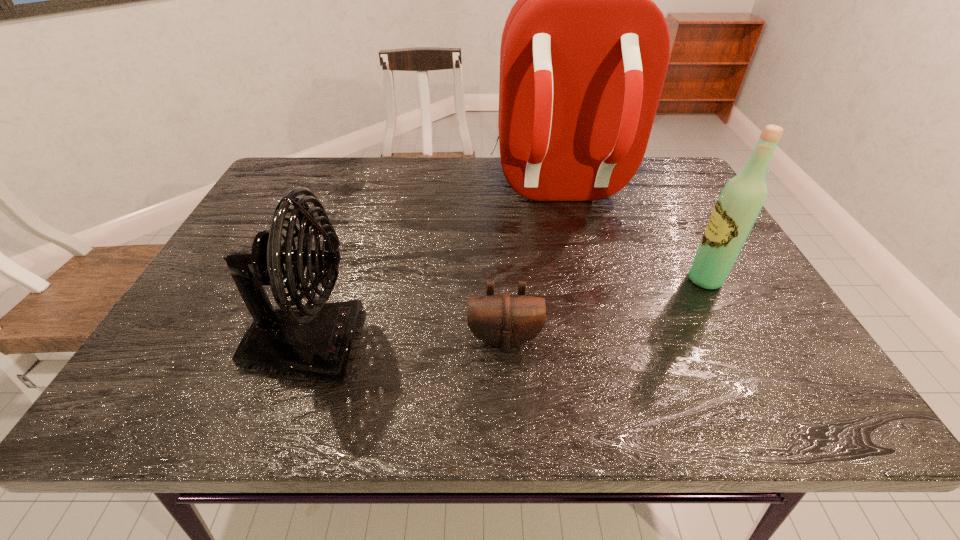
Select which object appears as the third closest to the pouch. Please provide its 2D coordinates. Your answer should be formatted as a tuple, i.e. [(x, y)], where the tuple contains the x and y coordinates of a point satisfying the conditions above.

[(742, 198)]

Locate an element on the screen. The height and width of the screenshot is (540, 960). object that is the second nearest to the fan is located at coordinates (584, 54).

This screenshot has width=960, height=540. I want to click on free location that satisfies the following two spatial constraints: 1. on the front-facing side of the third nearest object; 2. with the flap open on the pouch, so click(737, 339).

Where is `vacant space that satisfies the following two spatial constraints: 1. on the front-facing side of the rightmost object; 2. with the flap open on the pouch`? This screenshot has height=540, width=960. vacant space that satisfies the following two spatial constraints: 1. on the front-facing side of the rightmost object; 2. with the flap open on the pouch is located at coordinates (737, 339).

Find the location of a particular element. Image resolution: width=960 pixels, height=540 pixels. vacant space that satisfies the following two spatial constraints: 1. with the flap open on the pouch; 2. in front of the leftmost object to blow air is located at coordinates (505, 344).

In order to click on vacant space that satisfies the following two spatial constraints: 1. on the front-facing side of the wine bottle; 2. with the flap open on the shortest object in this screenshot , I will do `click(737, 339)`.

Locate an element on the screen. The height and width of the screenshot is (540, 960). free space that satisfies the following two spatial constraints: 1. with the flap open on the pouch; 2. in front of the fan to blow air is located at coordinates (505, 344).

Locate an element on the screen. This screenshot has height=540, width=960. vacant position in the image that satisfies the following two spatial constraints: 1. on the front-facing side of the wine bottle; 2. with the flap open on the shortest object is located at coordinates (737, 339).

You are a GUI agent. You are given a task and a screenshot of the screen. Output one action in this format:
    pyautogui.click(x=<x>, y=<y>)
    Task: Click on the vacant region that satisfies the following two spatial constraints: 1. on the strap side of the backpack; 2. in front of the fan to blow air
    
    Given the screenshot: What is the action you would take?
    pyautogui.click(x=596, y=344)